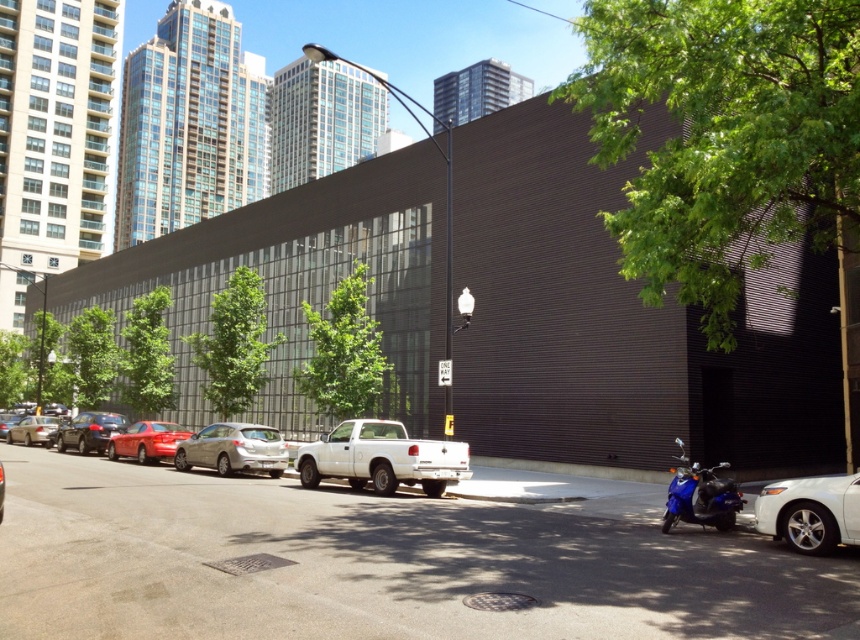
Is point (129, 440) positioned after point (71, 428)?

No, it is in front of (71, 428).

Is shiny red sedan at center to the left of shiny black sedan at center-left from the viewer's perspective?

No, shiny red sedan at center is not to the left of shiny black sedan at center-left.

Identify the location of shiny red sedan at center. (146, 442).

What do you see at coordinates (232, 449) in the screenshot?
I see `silver metallic sedan at center` at bounding box center [232, 449].

Does silver metallic sedan at center come behind shiny red sedan at center?

No, it is in front of shiny red sedan at center.

At what (x,y) coordinates should I click in order to perform the action: click on silver metallic sedan at center. Please return your answer as a coordinate pair (x, y). The width and height of the screenshot is (860, 640). Looking at the image, I should click on (232, 449).

Locate an element on the screen. The image size is (860, 640). silver metallic sedan at center is located at coordinates (232, 449).

Image resolution: width=860 pixels, height=640 pixels. What do you see at coordinates (381, 458) in the screenshot?
I see `white matte pickup truck at center` at bounding box center [381, 458].

Between white matte pickup truck at center and silver metallic sedan at center, which one is positioned higher?

white matte pickup truck at center

Is point (373, 480) more distant than point (197, 451)?

No.

Locate an element on the screen. white matte pickup truck at center is located at coordinates click(x=381, y=458).